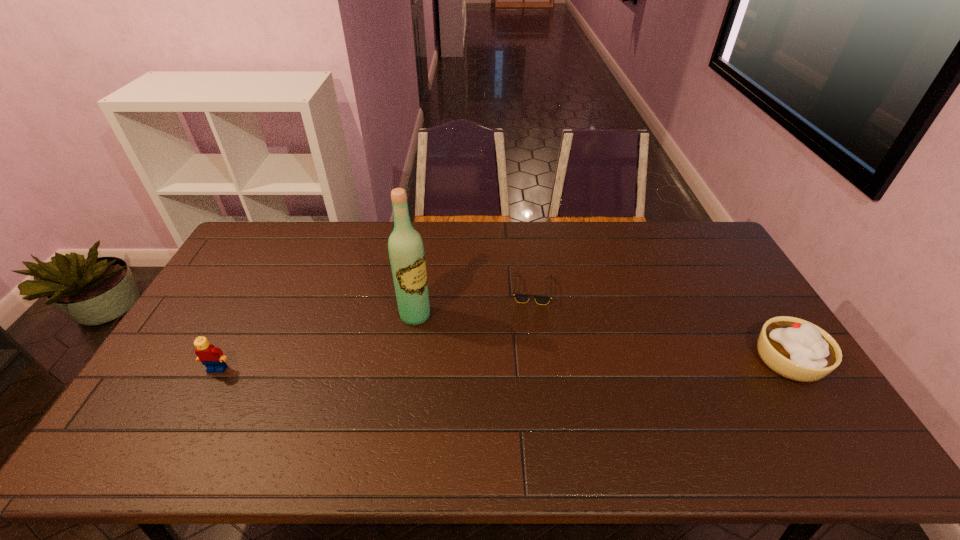
Find the location of `vacant space at the far right corner of the desktop`. vacant space at the far right corner of the desktop is located at coordinates (672, 226).

This screenshot has width=960, height=540. Find the location of `vacant area between the second object from left to right and the rightmost object`. vacant area between the second object from left to right and the rightmost object is located at coordinates (602, 338).

The image size is (960, 540). I want to click on vacant area that lies between the Lego and the whipped cream, so click(503, 364).

At what (x,y) coordinates should I click in order to perform the action: click on vacant area that lies between the leftmost object and the shortest object. Please return your answer as a coordinate pair (x, y). Looking at the image, I should click on (374, 329).

Identify the location of free space between the leftmost object and the third object from left to right. (374, 329).

Locate an element on the screen. free space between the rightmost object and the tallest object is located at coordinates (602, 338).

Where is `empty space that is in between the whipped cream and the shortest object`? The height and width of the screenshot is (540, 960). empty space that is in between the whipped cream and the shortest object is located at coordinates (660, 325).

Locate an element on the screen. unoccupied position between the rightmost object and the shortest object is located at coordinates (660, 325).

The image size is (960, 540). In order to click on free space between the rightmost object and the tallest object in this screenshot , I will do `click(602, 338)`.

Locate an element on the screen. free point between the whipped cream and the Lego is located at coordinates (503, 364).